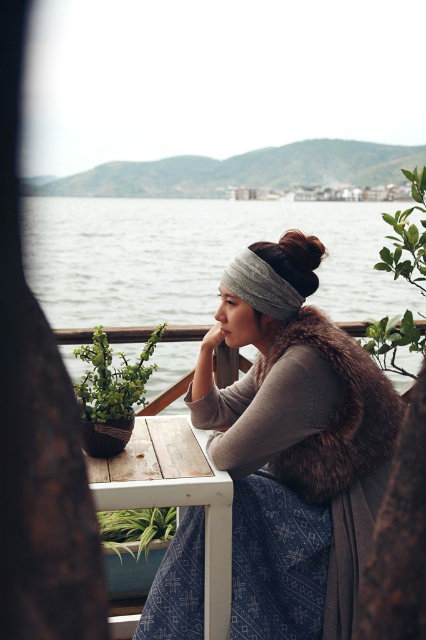
Question: Can you confirm if fuzzy brown vest at center is bigger than white wood table at center?

Choices:
 (A) yes
 (B) no

Answer: (A)

Question: Considering the relative positions of clear water at upper center and green leafy plant at right in the image provided, where is clear water at upper center located with respect to green leafy plant at right?

Choices:
 (A) right
 (B) left

Answer: (A)

Question: Is white wood table at center closer to the viewer compared to green leafy plant at right?

Choices:
 (A) no
 (B) yes

Answer: (B)

Question: Among these points, which one is farthest from the camera?

Choices:
 (A) (112, 230)
 (B) (385, 212)

Answer: (A)

Question: Among these objects, which one is nearest to the camera?

Choices:
 (A) green leafy plant at right
 (B) gray knitted headscarf at center

Answer: (B)

Question: Which point is farther to the camera?

Choices:
 (A) (417, 198)
 (B) (314, 232)

Answer: (B)